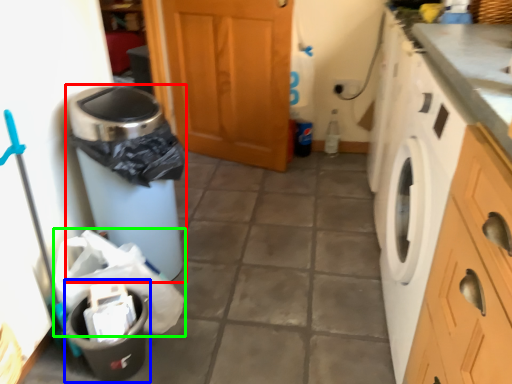
Question: Considering the real-world distances, which object is closest to waste container (highlighted by a red box)? recycling bin (highlighted by a blue box) or material (highlighted by a green box).

Choices:
 (A) recycling bin
 (B) material

Answer: (B)